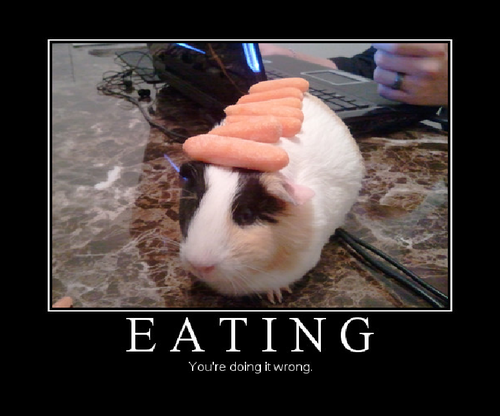
Identify the location of laptop cables. The height and width of the screenshot is (416, 500). (148, 116), (396, 261), (383, 267), (125, 76).